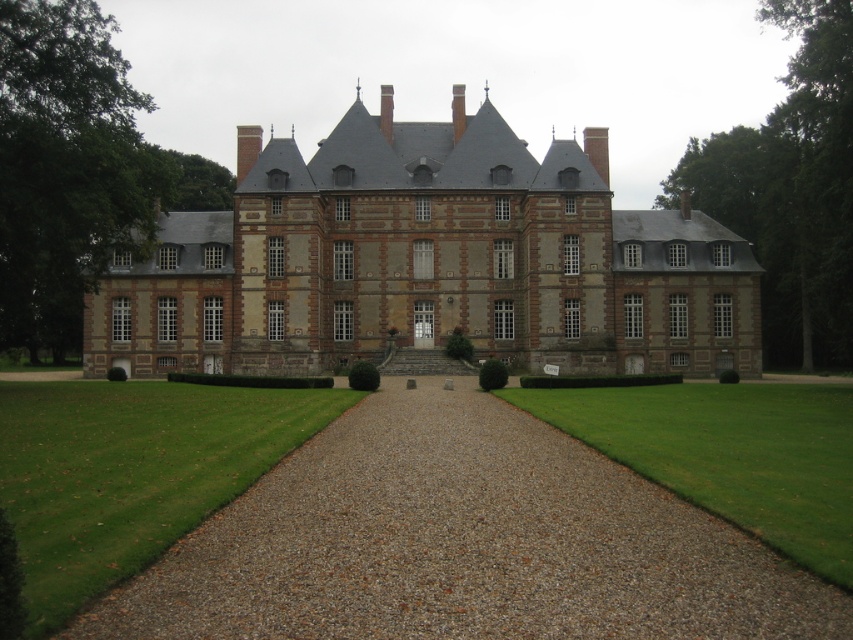
Locate an element on the screen. This screenshot has height=640, width=853. brown brick castle at center is located at coordinates (428, 260).

Who is more forward, (x=531, y=272) or (x=550, y=588)?

Point (x=550, y=588)

Identify the location of brown brick castle at center. The width and height of the screenshot is (853, 640). (428, 260).